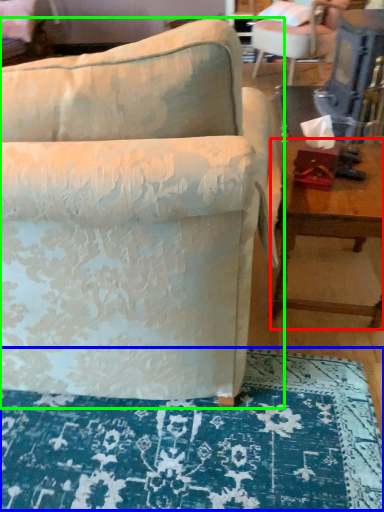
Question: Based on their relative distances, which object is nearer to table (highlighted by a red box)? Choose from mat (highlighted by a blue box) and chair (highlighted by a green box).

Choices:
 (A) mat
 (B) chair

Answer: (B)